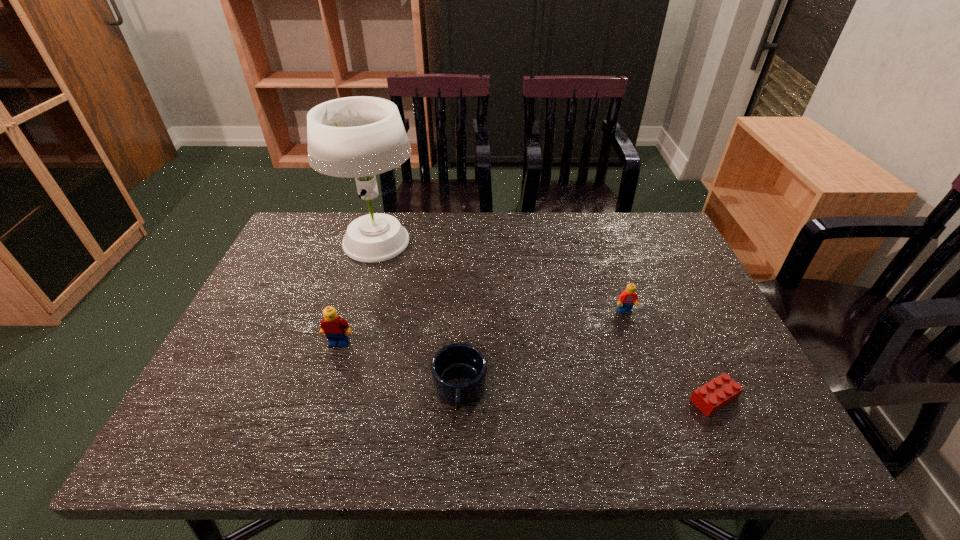
Where is `vacant area between the nearest Lego and the second Lego from right to left`? This screenshot has height=540, width=960. vacant area between the nearest Lego and the second Lego from right to left is located at coordinates (669, 355).

What are the coordinates of `vacant point located between the second tallest object and the lamp` in the screenshot? It's located at (358, 294).

Identify the location of vacant area that lies between the third object from left to right and the second farthest object. (542, 350).

Locate an element on the screen. This screenshot has height=540, width=960. free space between the second object from right to left and the third nearest object is located at coordinates (482, 327).

What are the coordinates of `vacant region between the lamp and the farthest Lego` in the screenshot? It's located at (501, 278).

Locate an element on the screen. This screenshot has width=960, height=540. vacant region between the second tallest object and the farthest Lego is located at coordinates (482, 327).

The height and width of the screenshot is (540, 960). Identify the location of empty location between the leftmost Lego and the mug. (399, 366).

Locate an element on the screen. The height and width of the screenshot is (540, 960). object that is the fourth nearest to the third object from right to left is located at coordinates (x=719, y=392).

Choose which object is the nearest neighbor to the mug. Please provide its 2D coordinates. Your answer should be formatted as a tuple, i.e. [(x, y)], where the tuple contains the x and y coordinates of a point satisfying the conditions above.

[(335, 328)]

This screenshot has height=540, width=960. Identify the location of Lego that stands as the closest to the shortest Lego. (627, 298).